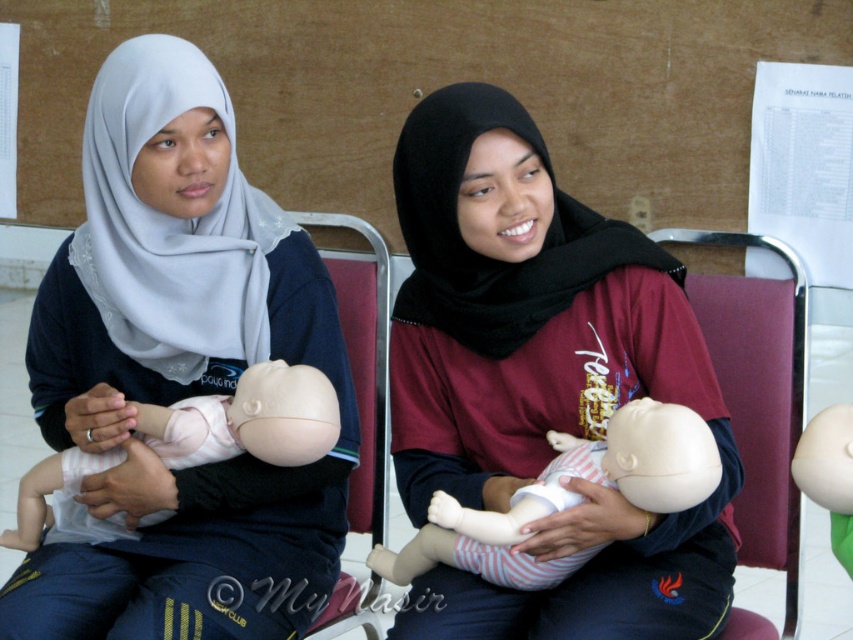
You are an observer in a classroom setting. You notice the matte white hijab at upper left and the matte plastic baby doll at center. Which object is positioned higher in the image?

The matte white hijab at upper left is located above the matte plastic baby doll at center, so it is positioned higher in the image.

You are a photographer in a classroom setting. You need to capture a photo where the matte white hijab at upper left and the matte plastic baby doll at center are both visible. Based on their positions, which object should be placed on the left side of the photo frame to ensure both are included?

The matte white hijab at upper left should be placed on the left side of the photo frame because it is to the left of the matte plastic baby doll at center, ensuring both are visible in the frame.

You are standing in a classroom and see the matte white hijab at upper left. If you want to hand a document to the person wearing it without moving closer than 5 feet, is it possible?

The matte white hijab at upper left and viewer are 5.21 feet apart from each other, so yes, you can hand the document without moving closer than 5 feet since the distance is slightly more than 5 feet.